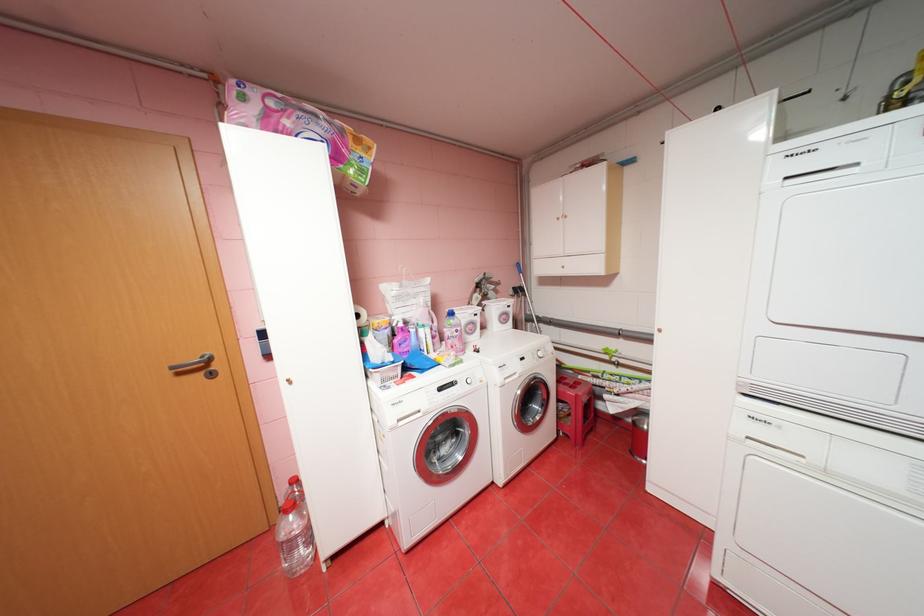
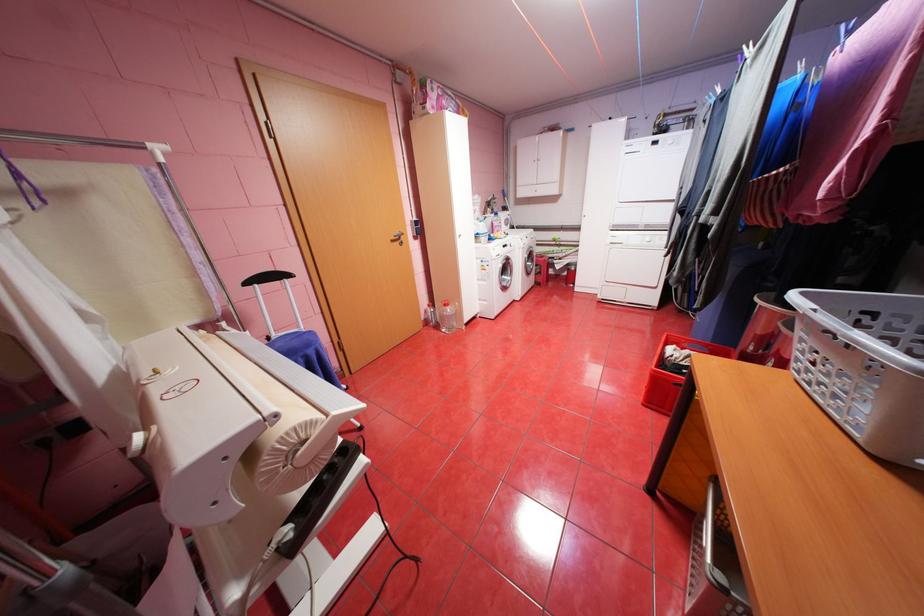
Where in the second image is the point corresponding to point (188, 373) from the first image?

(400, 241)